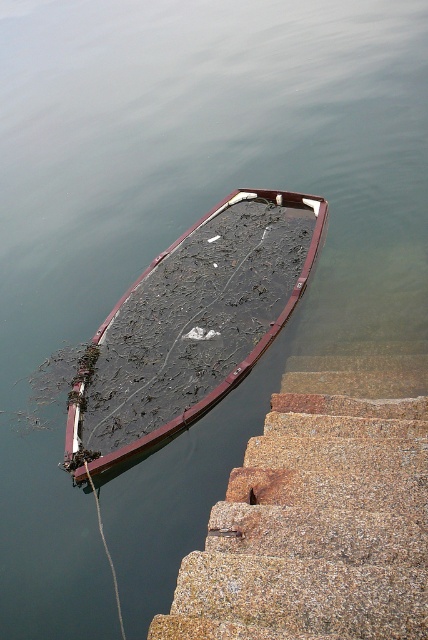
Question: Observing the image, what is the correct spatial positioning of granite steps at lower right in reference to rusty metal boat at lower left?

Choices:
 (A) right
 (B) left

Answer: (A)

Question: Where is granite steps at lower right located in relation to rusty metal boat at lower left in the image?

Choices:
 (A) below
 (B) above

Answer: (A)

Question: Which point is farther to the camera?

Choices:
 (A) (243, 572)
 (B) (299, 195)

Answer: (B)

Question: Does granite steps at lower right appear on the right side of rusty metal boat at lower left?

Choices:
 (A) no
 (B) yes

Answer: (B)